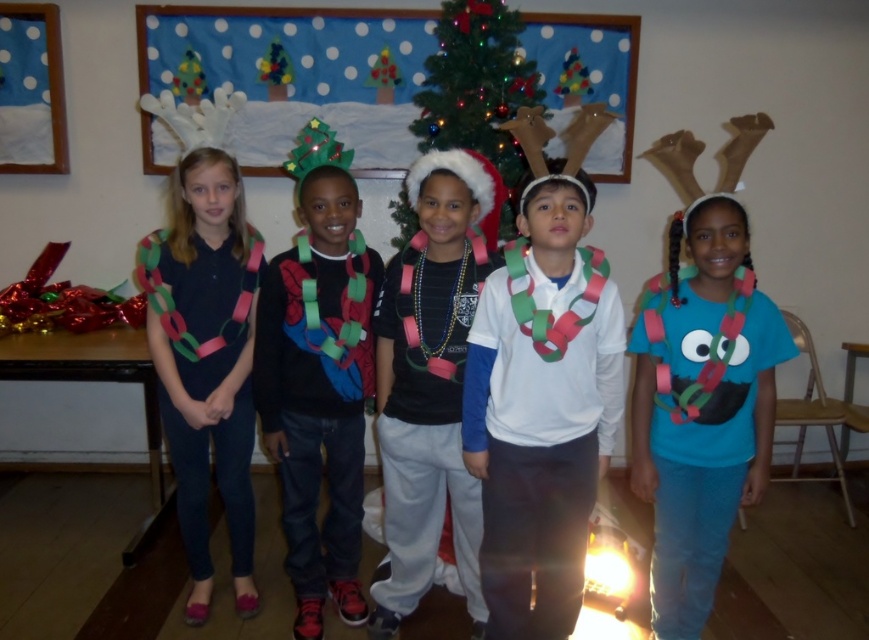
Question: Can you confirm if matte black shirt at center is bigger than matte paper chain at left?

Choices:
 (A) yes
 (B) no

Answer: (A)

Question: Among these objects, which one is nearest to the camera?

Choices:
 (A) matte paper chain at left
 (B) blue fabric shirt with paper chains at center
 (C) white matte shirt at center

Answer: (C)

Question: Which point is closer to the camera?

Choices:
 (A) (558, 552)
 (B) (668, 468)

Answer: (A)

Question: Which object is positioned farthest from the matte paper chain at left?

Choices:
 (A) white matte shirt at center
 (B) blue fabric shirt with paper chains at center
 (C) green paper chain at center

Answer: (B)

Question: From the image, what is the correct spatial relationship of white matte shirt at center in relation to matte paper chain at center?

Choices:
 (A) below
 (B) above

Answer: (A)

Question: Does matte paper chain at center have a lesser width compared to green paper chain at center?

Choices:
 (A) yes
 (B) no

Answer: (A)